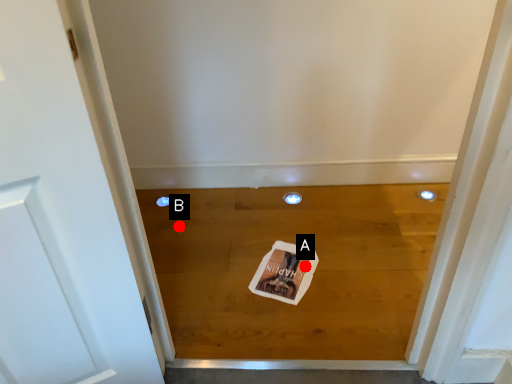
Question: Two points are circled on the image, labeled by A and B beside each circle. Which of the following is the farthest from the observer?

Choices:
 (A) A is further
 (B) B is further

Answer: (B)